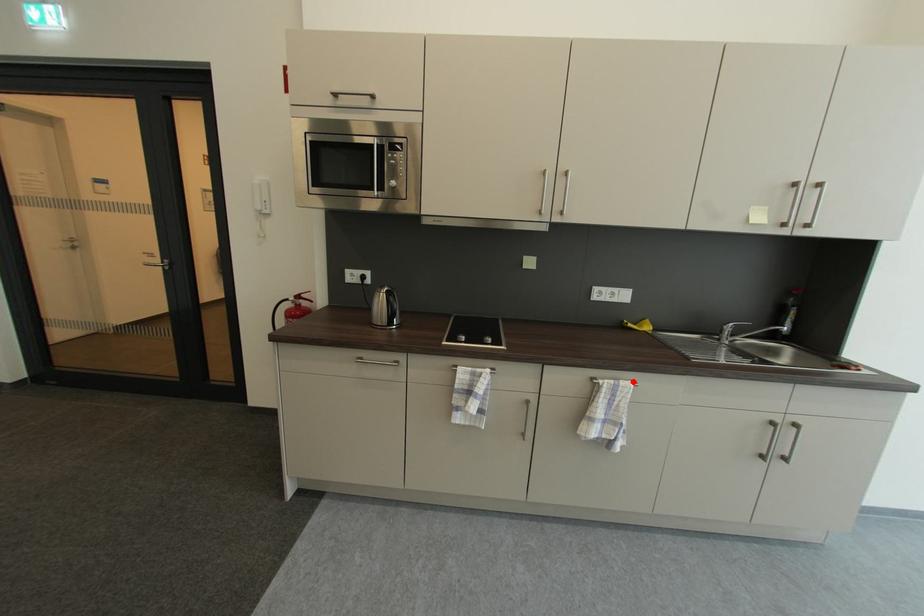
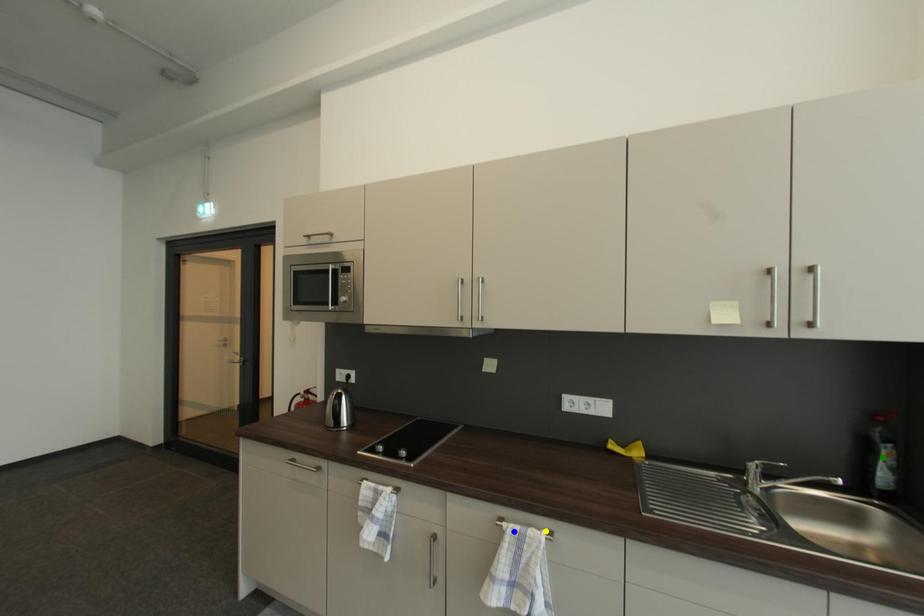
Question: I am providing you with two images of the same scene from different viewpoints. A red point is marked on the first image. You are given multiple points on the second image. In image 2, which mark is for the same physical point as the one in image 1?

Choices:
 (A) blue point
 (B) yellow point
 (C) green point

Answer: (B)